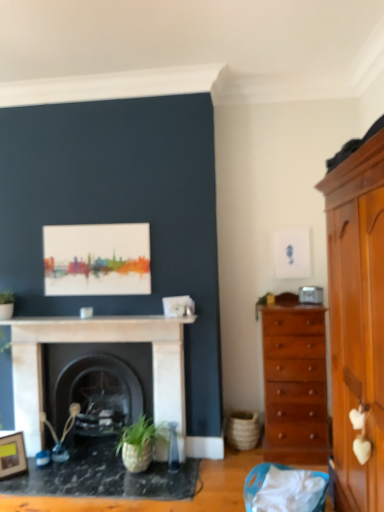
Question: Which is correct: green matte plant at upper right is inside light brown wooden cabinet at right, or outside of it?

Choices:
 (A) outside
 (B) inside

Answer: (A)

Question: Considering the positions of point (274, 300) and point (372, 321), is point (274, 300) closer or farther from the camera than point (372, 321)?

Choices:
 (A) farther
 (B) closer

Answer: (A)

Question: Estimate the real-world distances between objects in this image. Which object is farther from the wooden picture frame at lower left?

Choices:
 (A) shiny brown chest of drawers at right
 (B) white marble fireplace at center
 (C) light brown wooden cabinet at right
 (D) black marble table at lower left
 (E) green matte plant at upper right

Answer: (C)

Question: Considering the real-world distances, which object is farthest from the black marble table at lower left?

Choices:
 (A) wooden picture frame at lower left
 (B) white marble fireplace at center, which ranks as the second fireplace in back-to-front order
 (C) white marble fireplace at center
 (D) shiny brown chest of drawers at right
 (E) black marble fireplace at center, acting as the second fireplace starting from the front

Answer: (D)